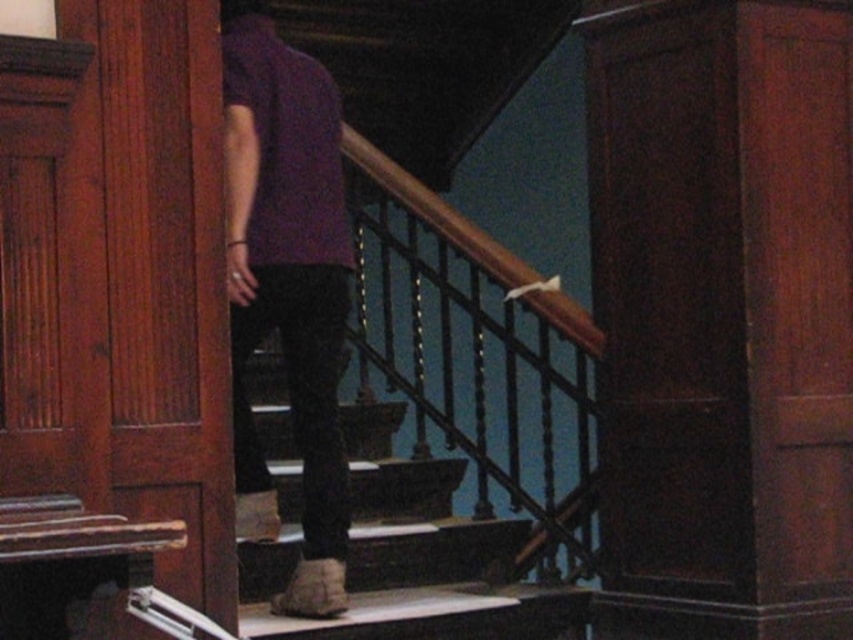
Which is behind, point (737, 323) or point (318, 572)?

Positioned behind is point (737, 323).

Which of these two, dark wood pillar at center or purple cotton shirt at center, stands taller?

With more height is dark wood pillar at center.

Does point (683, 154) lie in front of point (254, 256)?

No, (683, 154) is behind (254, 256).

Locate an element on the screen. This screenshot has width=853, height=640. dark wood pillar at center is located at coordinates (722, 314).

Is purple cotton shirt at center above wooden stairs at center?

Yes, purple cotton shirt at center is above wooden stairs at center.

Does purple cotton shirt at center appear on the left side of wooden stairs at center?

Indeed, purple cotton shirt at center is positioned on the left side of wooden stairs at center.

Who is more distant from viewer, (247, 305) or (326, 632)?

The point (247, 305) is behind.

The width and height of the screenshot is (853, 640). Find the location of `purple cotton shirt at center`. purple cotton shirt at center is located at coordinates (287, 285).

The image size is (853, 640). Identify the location of dark wood pillar at center. (722, 314).

Is the position of dark wood pillar at center less distant than that of wooden stairs at center?

No, it is not.

Describe the element at coordinates (722, 314) in the screenshot. I see `dark wood pillar at center` at that location.

At what (x,y) coordinates should I click in order to perform the action: click on dark wood pillar at center. Please return your answer as a coordinate pair (x, y). The height and width of the screenshot is (640, 853). Looking at the image, I should click on (722, 314).